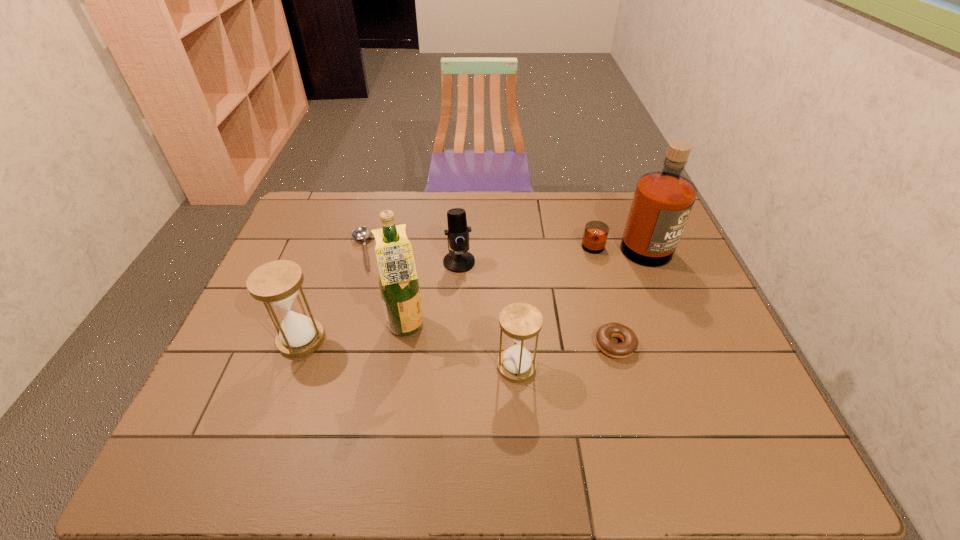
Identify the location of vacant area situated 0.070m on the left of the third tallest object. The image size is (960, 540). (252, 340).

The image size is (960, 540). What are the coordinates of `vacant space located 0.140m on the left of the shorter hourglass` in the screenshot? It's located at (441, 367).

Where is `vacant area located 0.100m on the right of the shortest object`? This screenshot has height=540, width=960. vacant area located 0.100m on the right of the shortest object is located at coordinates (406, 251).

At what (x,y) coordinates should I click in order to perform the action: click on free region located 0.180m on the stand of the microphone. Please return your answer as a coordinate pair (x, y). Looking at the image, I should click on (456, 318).

Find the location of a particular element. The image size is (960, 540). free space located on the front label of the right liquor is located at coordinates (659, 335).

What are the coordinates of `vacant space located 0.380m on the front-facing side of the left liquor` in the screenshot? It's located at (569, 328).

Locate an element on the screen. This screenshot has width=960, height=540. vacant position located on the back of the sixth tallest object is located at coordinates (595, 270).

This screenshot has height=540, width=960. I want to click on object situated at the far edge, so click(362, 233).

Image resolution: width=960 pixels, height=540 pixels. Find the location of `object that is at the left edge`. object that is at the left edge is located at coordinates (277, 283).

Where is `object located in the right edge section of the desktop`? The image size is (960, 540). object located in the right edge section of the desktop is located at coordinates (662, 202).